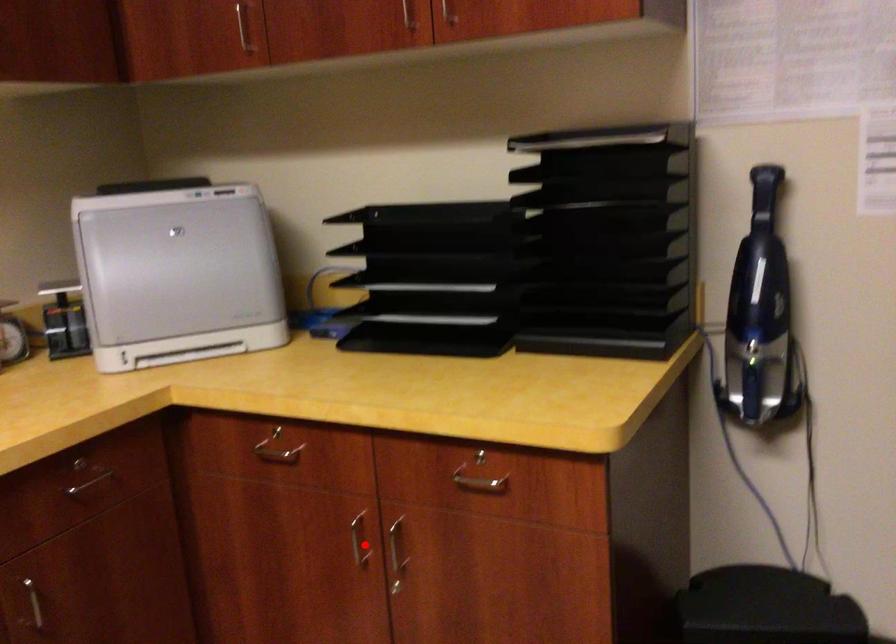
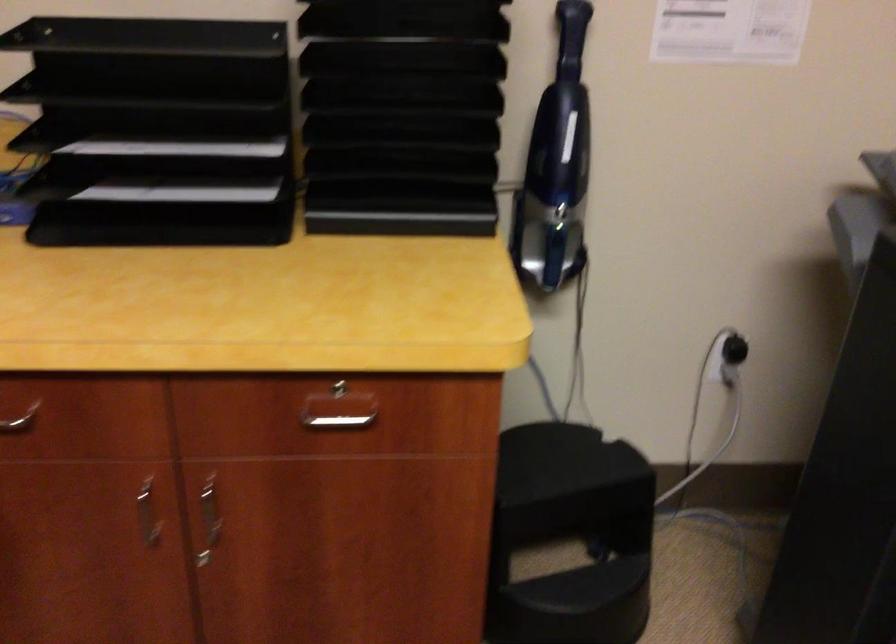
Question: I am providing you with two images of the same scene from different viewpoints. A red point is shown in image1. For the corresponding object point in image2, is it positioned nearer or farther from the camera?

Choices:
 (A) Nearer
 (B) Farther

Answer: (A)